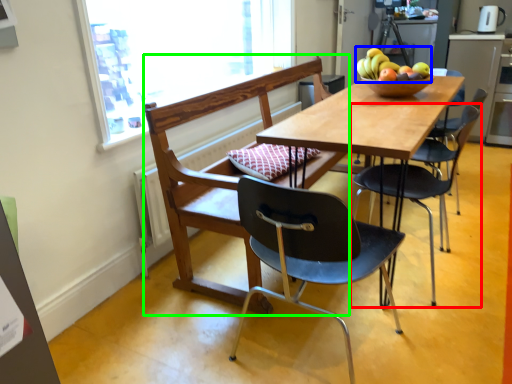
Question: Which is nearer to the chair (highlighted by a red box)? fruit (highlighted by a blue box) or chair (highlighted by a green box).

Choices:
 (A) fruit
 (B) chair

Answer: (A)